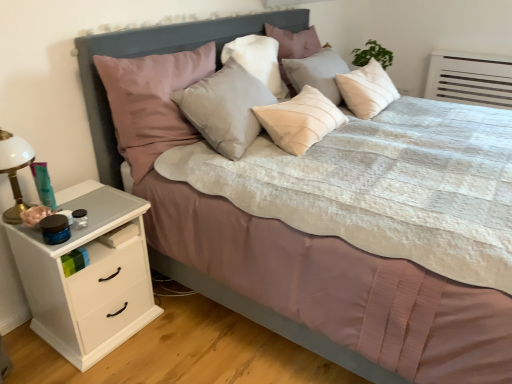
Question: Should I look upward or downward to see velvet pink pillow at upper left, arranged as the 1th pillow when viewed from the left?

Choices:
 (A) up
 (B) down

Answer: (A)

Question: Is matte gray pillow at center, which appears as the 2th pillow when viewed from the left, oriented towards velvet pink pillow at upper left, arranged as the 1th pillow when viewed from the left?

Choices:
 (A) no
 (B) yes

Answer: (A)

Question: Would you say velvet pink pillow at upper left, arranged as the 1th pillow when viewed from the left, is part of matte gray pillow at center, which appears as the 2th pillow when viewed from the left,'s contents?

Choices:
 (A) no
 (B) yes

Answer: (A)

Question: Is matte gray pillow at center, which appears as the 2th pillow when viewed from the left, smaller than velvet pink pillow at upper left, arranged as the 1th pillow when viewed from the left?

Choices:
 (A) no
 (B) yes

Answer: (B)

Question: From a real-world perspective, is matte gray pillow at center, which appears as the 2th pillow when viewed from the left, positioned under velvet pink pillow at upper left, the third pillow positioned from the right, based on gravity?

Choices:
 (A) yes
 (B) no

Answer: (B)

Question: Is matte gray pillow at center, which appears as the 2th pillow when viewed from the left, bigger than velvet pink pillow at upper left, arranged as the 1th pillow when viewed from the left?

Choices:
 (A) yes
 (B) no

Answer: (B)

Question: Is matte gray pillow at center, which appears as the 2th pillow when viewed from the left, thinner than velvet pink pillow at upper left, the third pillow positioned from the right?

Choices:
 (A) yes
 (B) no

Answer: (A)

Question: Is light beige fabric pillow at center, which appears as the 3th pillow when viewed from the left, next to white matte chest of drawers at left and touching it?

Choices:
 (A) no
 (B) yes

Answer: (A)

Question: Considering the relative positions of light beige fabric pillow at center, which ranks as the 1th pillow in right-to-left order, and white matte chest of drawers at left in the image provided, is light beige fabric pillow at center, which ranks as the 1th pillow in right-to-left order, to the right of white matte chest of drawers at left from the viewer's perspective?

Choices:
 (A) yes
 (B) no

Answer: (A)

Question: From the image's perspective, is light beige fabric pillow at center, which ranks as the 1th pillow in right-to-left order, below white matte chest of drawers at left?

Choices:
 (A) no
 (B) yes

Answer: (A)

Question: Is light beige fabric pillow at center, which ranks as the 1th pillow in right-to-left order, not close to white matte chest of drawers at left?

Choices:
 (A) no
 (B) yes

Answer: (B)

Question: Is light beige fabric pillow at center, which ranks as the 1th pillow in right-to-left order, surrounding white matte chest of drawers at left?

Choices:
 (A) yes
 (B) no

Answer: (B)

Question: Is light beige fabric pillow at center, which appears as the 3th pillow when viewed from the left, further to the viewer compared to white matte chest of drawers at left?

Choices:
 (A) no
 (B) yes

Answer: (B)

Question: From the image's perspective, is velvet pink pillow at upper left, the third pillow positioned from the right, on white matte chest of drawers at left?

Choices:
 (A) no
 (B) yes

Answer: (B)